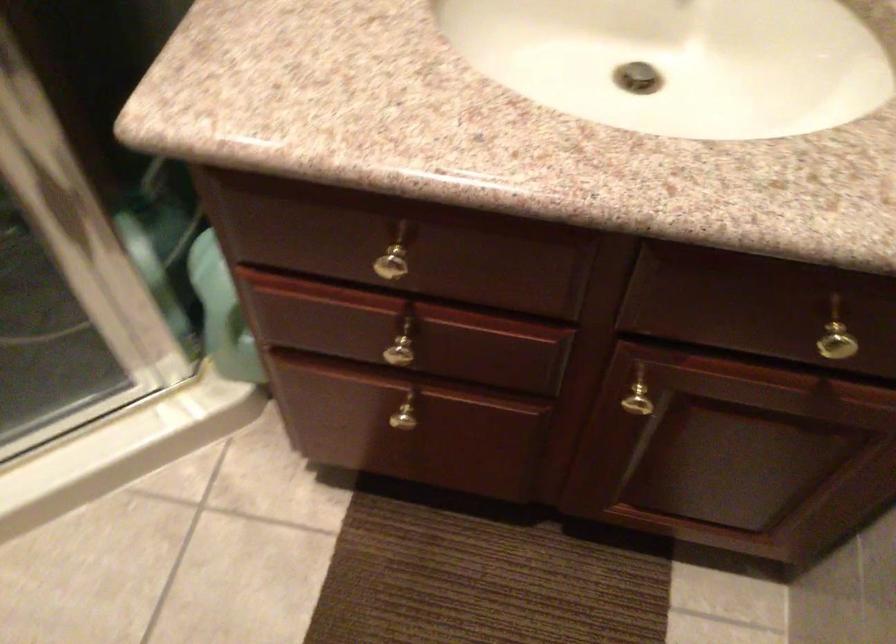
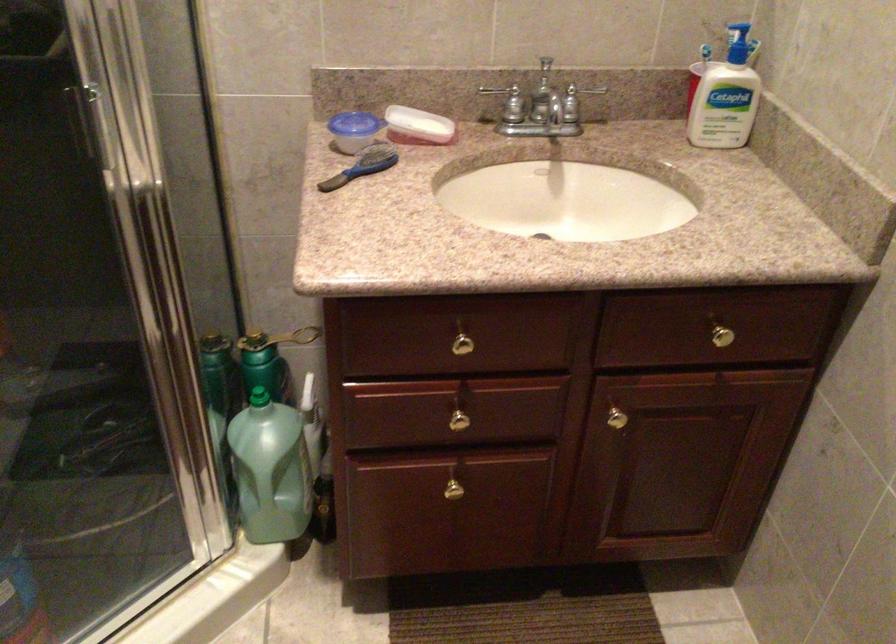
Where in the second image is the point corresponding to the point at 410,417 from the first image?

(455, 488)